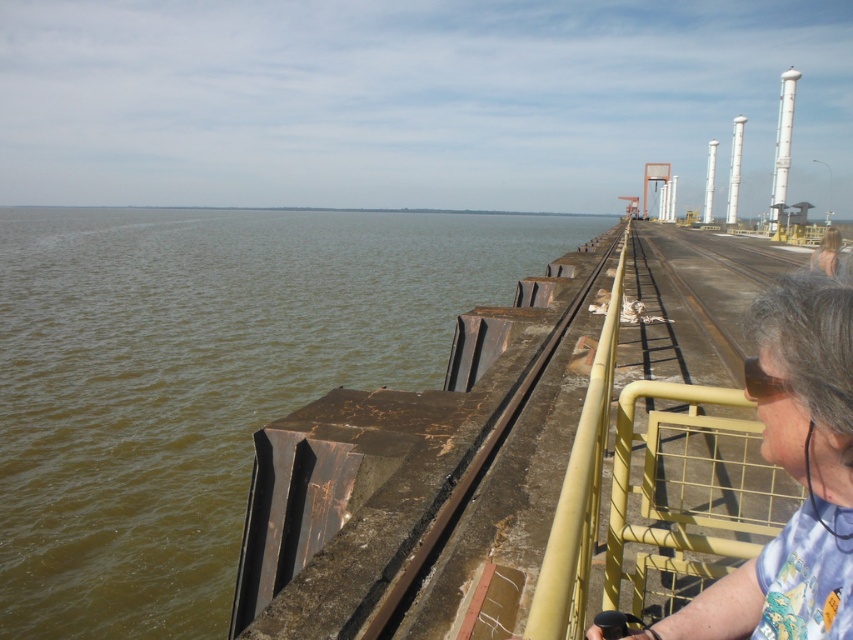
You are standing on the pier and want to move from point (x=166, y=301) to point (x=450, y=508). Which direction should you walk to get closer to the latter point?

You should walk away from the camera because point (x=166, y=301) is closer to the camera than point (x=450, y=508). Moving away from the camera will take you towards point (x=450, y=508).

You are standing on the pier and want to check the thickness of the objects around you. Which object, the gray hair at right or the yellow metal rail at center, has a smaller width?

The gray hair at right is thinner than the yellow metal rail at center, so the gray hair at right has a smaller width.